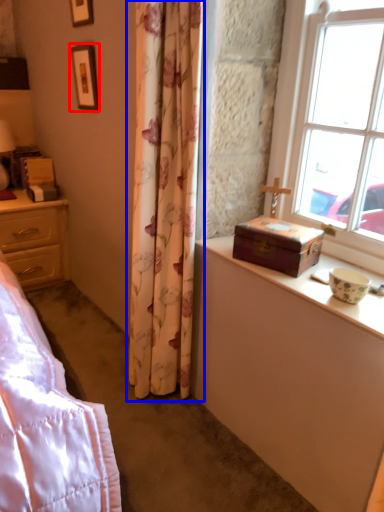
Question: Which of the following is the farthest to the observer, picture frame (highlighted by a red box) or curtain (highlighted by a blue box)?

Choices:
 (A) picture frame
 (B) curtain

Answer: (A)